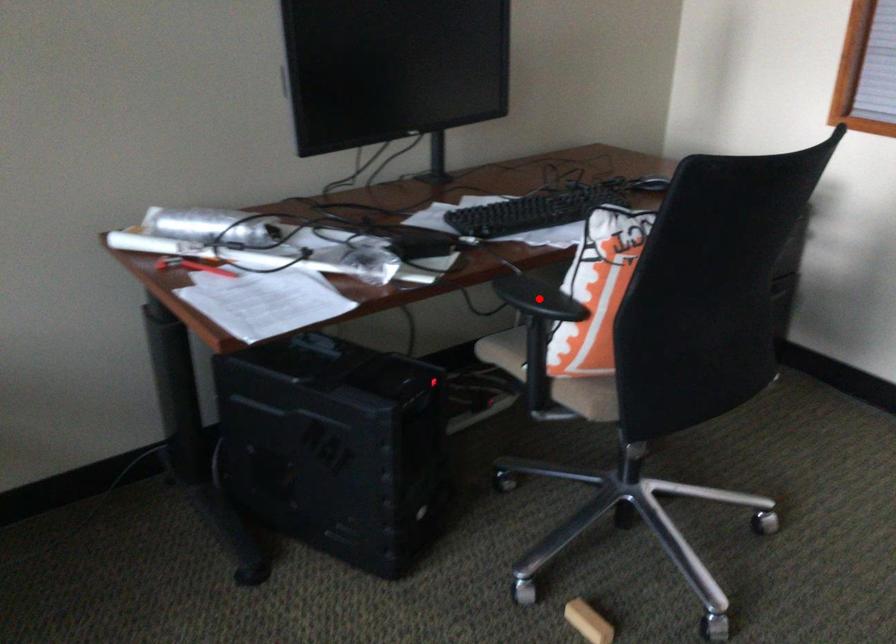
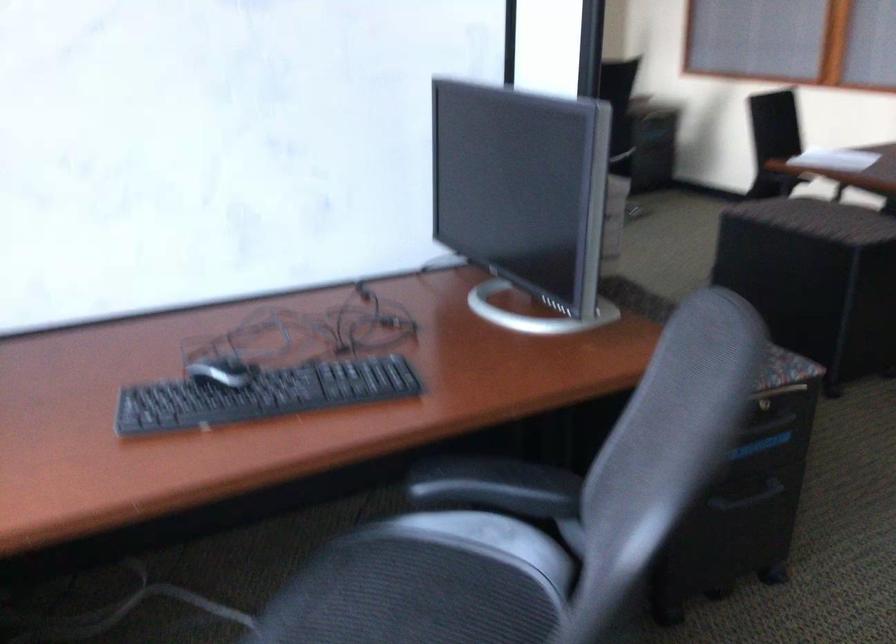
Question: I am providing you with two images of the same scene from different viewpoints. A red point is marked on the first image. Can you still see the location of the red point in image 2?

Choices:
 (A) Yes
 (B) No

Answer: (B)